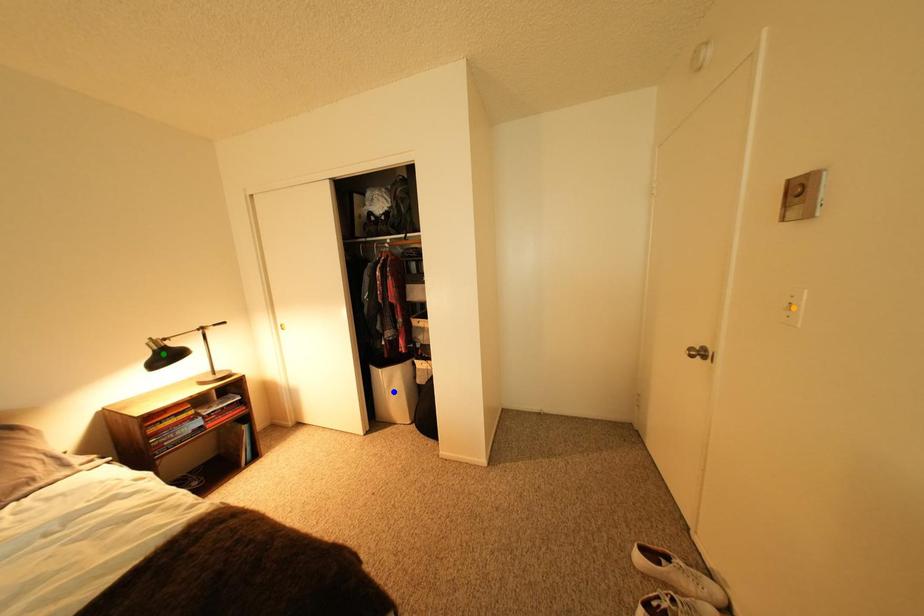
Order these from farthest to nearest:
A) green point
B) orange point
C) blue point

blue point → green point → orange point